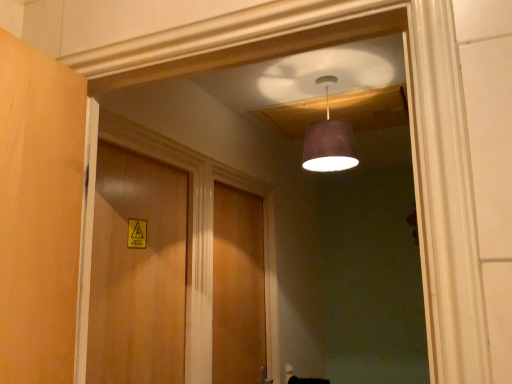
Question: Is wooden door at center, the 2th door in the right-to-left sequence, thinner than matte purple lampshade at upper center?

Choices:
 (A) no
 (B) yes

Answer: (B)

Question: Could matte purple lampshade at upper center be considered to be inside wooden door at center, which is the 1th door in front-to-back order?

Choices:
 (A) yes
 (B) no

Answer: (B)

Question: From the image's perspective, is wooden door at center, which is the 1th door in front-to-back order, over matte purple lampshade at upper center?

Choices:
 (A) no
 (B) yes

Answer: (A)

Question: Are wooden door at center, the 2th door in the right-to-left sequence, and matte purple lampshade at upper center making contact?

Choices:
 (A) yes
 (B) no

Answer: (B)

Question: Considering the relative sizes of wooden door at center, the 2th door from the back, and matte purple lampshade at upper center in the image provided, is wooden door at center, the 2th door from the back, smaller than matte purple lampshade at upper center?

Choices:
 (A) no
 (B) yes

Answer: (A)

Question: Which is correct: matte purple lampshade at upper center is inside wooden door at center, the 2th door from the back, or outside of it?

Choices:
 (A) outside
 (B) inside

Answer: (A)

Question: Considering the positions of matte purple lampshade at upper center and wooden door at center, the 2th door in the right-to-left sequence, in the image, is matte purple lampshade at upper center wider or thinner than wooden door at center, the 2th door in the right-to-left sequence,?

Choices:
 (A) wide
 (B) thin

Answer: (A)

Question: From the image's perspective, is matte purple lampshade at upper center positioned above or below wooden door at center, the 2th door from the back?

Choices:
 (A) below
 (B) above

Answer: (B)

Question: Considering the relative positions of matte purple lampshade at upper center and wooden door at center, the 2th door in the right-to-left sequence, in the image provided, is matte purple lampshade at upper center to the left or to the right of wooden door at center, the 2th door in the right-to-left sequence,?

Choices:
 (A) right
 (B) left

Answer: (A)

Question: Looking at the image, does wooden door at center, the 2th door from the back, seem bigger or smaller compared to matte purple lampshade at upper center?

Choices:
 (A) big
 (B) small

Answer: (A)

Question: Which is correct: wooden door at center, the 2th door in the right-to-left sequence, is inside matte purple lampshade at upper center, or outside of it?

Choices:
 (A) inside
 (B) outside

Answer: (B)

Question: Considering their positions, is wooden door at center, which is the 1th door in front-to-back order, located in front of or behind matte purple lampshade at upper center?

Choices:
 (A) behind
 (B) front

Answer: (B)

Question: Is wooden door at center, the 2th door in the right-to-left sequence, wider or thinner than matte purple lampshade at upper center?

Choices:
 (A) wide
 (B) thin

Answer: (B)

Question: Considering the positions of wooden door at center, which appears as the second door when viewed from the left, and matte purple lampshade at upper center in the image, is wooden door at center, which appears as the second door when viewed from the left, taller or shorter than matte purple lampshade at upper center?

Choices:
 (A) short
 (B) tall

Answer: (B)

Question: From the image's perspective, is wooden door at center, acting as the 1th door starting from the back, positioned above or below matte purple lampshade at upper center?

Choices:
 (A) above
 (B) below

Answer: (B)